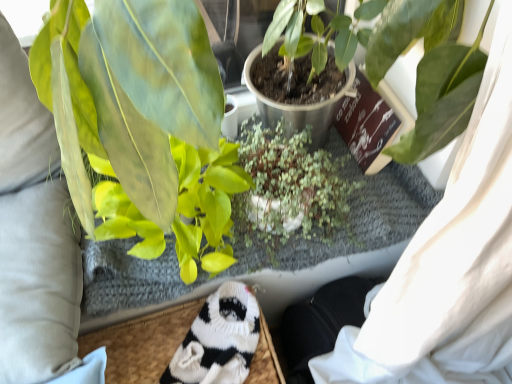
Question: From a real-world perspective, relative to white knitted socks at lower center, is green matte plant at center, positioned as the 3th houseplant in back-to-front order, vertically above or below?

Choices:
 (A) below
 (B) above

Answer: (B)

Question: Considering the relative positions of green matte plant at center, the 1th houseplant when ordered from front to back, and white knitted socks at lower center in the image provided, is green matte plant at center, the 1th houseplant when ordered from front to back, to the left or to the right of white knitted socks at lower center?

Choices:
 (A) right
 (B) left

Answer: (A)

Question: Which is farther from the green matte plant at center, positioned as the third houseplant in front-to-back order?

Choices:
 (A) green matte plant at center, positioned as the 3th houseplant in back-to-front order
 (B) green matte leafy plant at left, which ranks as the second houseplant in front-to-back order
 (C) white knitted socks at lower center
 (D) white knitted socks at lower left

Answer: (D)

Question: Estimate the real-world distances between objects in this image. Which object is closer to the white knitted socks at lower center?

Choices:
 (A) green matte plant at center, positioned as the 3th houseplant in back-to-front order
 (B) green matte leafy plant at left, which ranks as the second houseplant in front-to-back order
 (C) white knitted socks at lower left
 (D) green matte plant at center, which is the 1th houseplant in back-to-front order

Answer: (D)